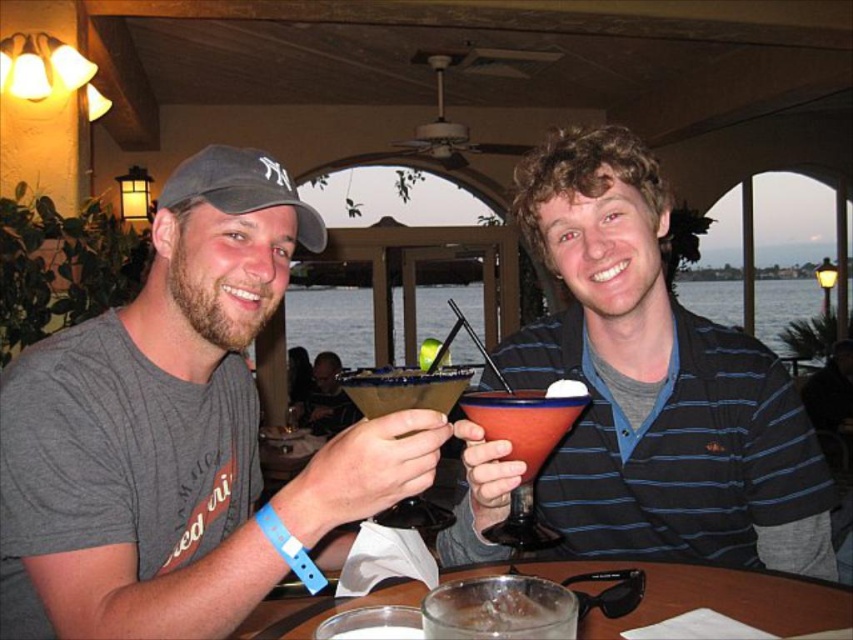
You are standing in front of the table where the two people are sitting. You want to pick up the item located at point (195,364) and move it to the other side of the table. However, there is an obstacle at point (554,492). Can you safely move the item without hitting the obstacle?

Point (195,364) is closer to the viewer than point (554,492), so moving the item from point (195,364) to the other side of the table would require navigating around the obstacle at point (554,492). Since the obstacle is farther away, you can safely move the item without hitting it by moving along a path that stays closer to your position.